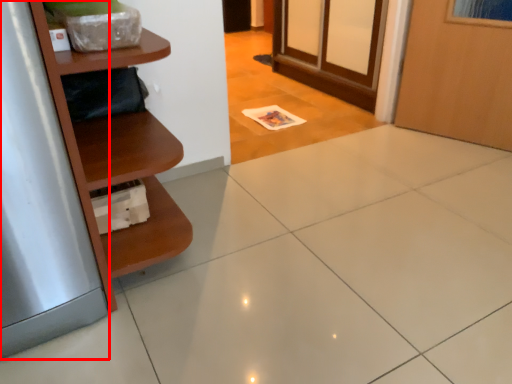
Question: From the image's perspective, what is the correct spatial relationship of silver (annotated by the red box) in relation to shelf?

Choices:
 (A) above
 (B) below

Answer: (B)